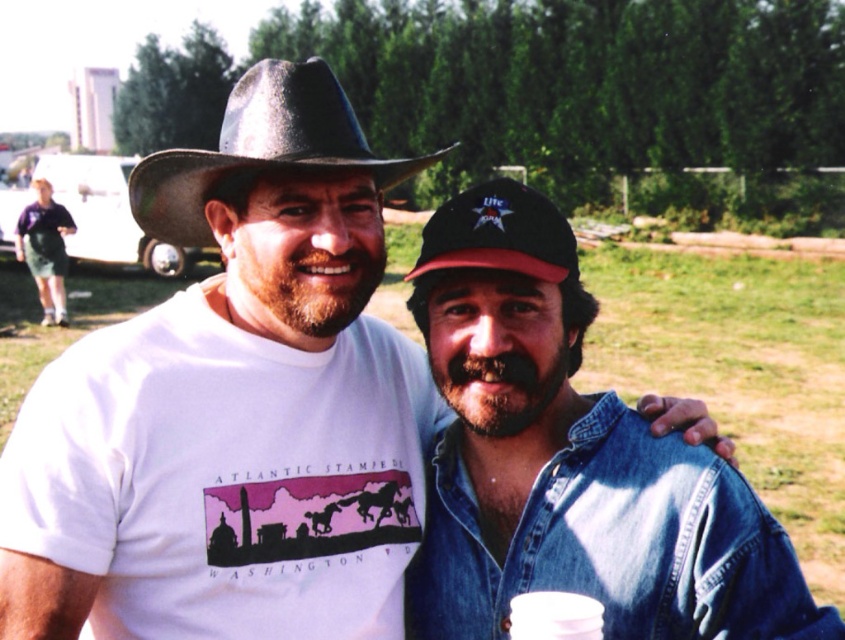
Question: Is denim jacket at center below dark gray felt cowboy hat at upper left?

Choices:
 (A) no
 (B) yes

Answer: (B)

Question: Which object is positioned farthest from the dark gray felt cowboy hat at upper left?

Choices:
 (A) white plastic cup at lower center
 (B) denim jacket at center

Answer: (A)

Question: Which point is farther from the camera taking this photo?

Choices:
 (A) [571, 609]
 (B) [593, 582]
 (C) [150, 202]

Answer: (C)

Question: Which of the following is the farthest from the observer?

Choices:
 (A) denim jacket at center
 (B) white plastic cup at lower center
 (C) dark gray felt cowboy hat at upper left

Answer: (C)

Question: Is denim jacket at center further to camera compared to dark gray felt cowboy hat at upper left?

Choices:
 (A) no
 (B) yes

Answer: (A)

Question: From the image, what is the correct spatial relationship of dark gray felt cowboy hat at upper left in relation to white plastic cup at lower center?

Choices:
 (A) left
 (B) right

Answer: (A)